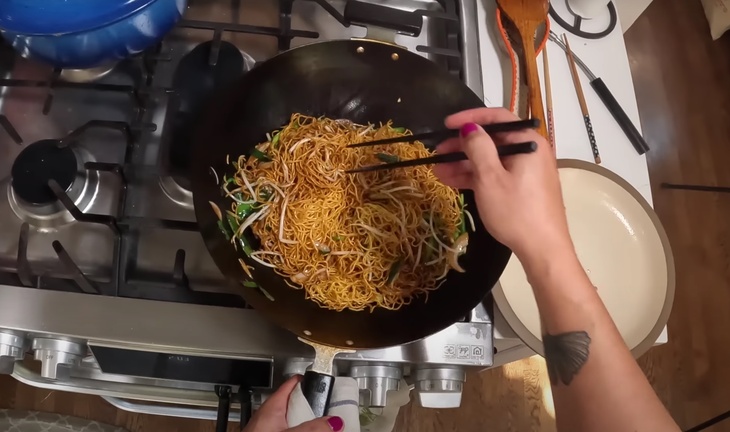
Locate an element on the screen. plate is located at coordinates (599, 263).